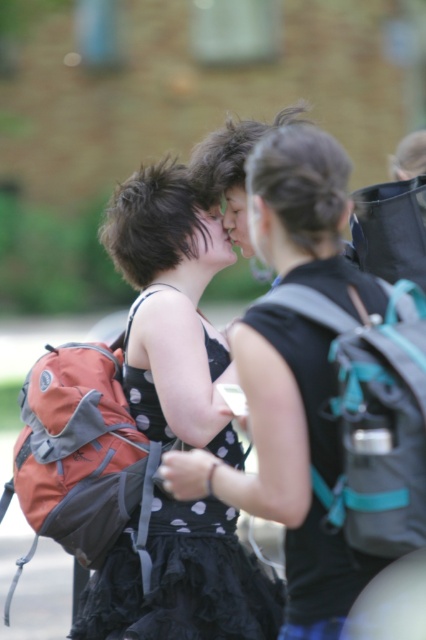
Question: Can you confirm if teal fabric backpack at center is positioned below black dotted fabric dress at center?

Choices:
 (A) yes
 (B) no

Answer: (B)

Question: Is the position of matte black backpack at center more distant than that of teal fabric backpack at center?

Choices:
 (A) yes
 (B) no

Answer: (B)

Question: Which point is closer to the camera taking this photo?

Choices:
 (A) (222, 456)
 (B) (294, 376)
 (C) (383, 291)

Answer: (B)

Question: Is matte black backpack at center bigger than black dotted fabric dress at center?

Choices:
 (A) no
 (B) yes

Answer: (B)

Question: Which point is closer to the camera taking this photo?

Choices:
 (A) (173, 493)
 (B) (412, 544)

Answer: (B)

Question: Which point appears closest to the camera in this image?

Choices:
 (A) (419, 429)
 (B) (296, 237)

Answer: (A)